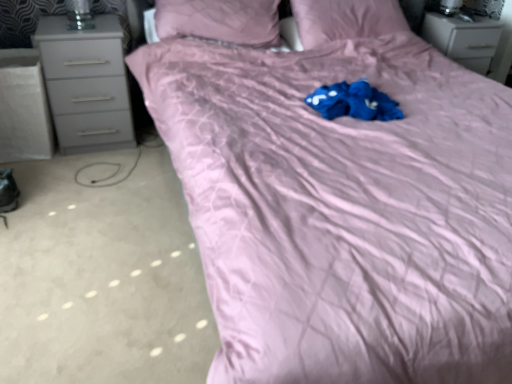
Question: Considering the relative positions of matte pink pillow at upper center, which ranks as the 2th pillow in left-to-right order, and matte pink pillow at upper center, the second pillow positioned from the right, in the image provided, is matte pink pillow at upper center, which ranks as the 2th pillow in left-to-right order, to the left or to the right of matte pink pillow at upper center, the second pillow positioned from the right,?

Choices:
 (A) right
 (B) left

Answer: (A)

Question: From the image's perspective, relative to matte pink pillow at upper center, the second pillow positioned from the right, is matte pink pillow at upper center, which ranks as the 2th pillow in left-to-right order, above or below?

Choices:
 (A) above
 (B) below

Answer: (A)

Question: Which is farther from the matte gray chest of drawers at upper right, placed as the 1th chest of drawers when sorted from back to front?

Choices:
 (A) matte pink pillow at upper center, the second pillow positioned from the right
 (B) gray matte chest of drawers at left, which is counted as the second chest of drawers, starting from the back
 (C) matte pink pillow at upper center, which ranks as the 2th pillow in left-to-right order

Answer: (B)

Question: Which object is positioned closest to the matte pink pillow at upper center, positioned as the first pillow in right-to-left order?

Choices:
 (A) matte pink pillow at upper center, the second pillow positioned from the right
 (B) gray matte chest of drawers at left, acting as the second chest of drawers starting from the right
 (C) matte gray chest of drawers at upper right, the 2th chest of drawers when ordered from left to right

Answer: (A)